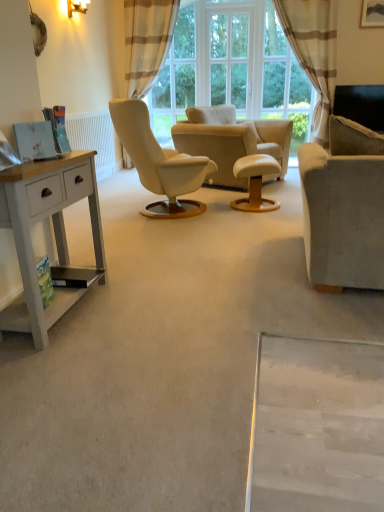
The image size is (384, 512). What do you see at coordinates (232, 142) in the screenshot? I see `beige fabric armchair at center` at bounding box center [232, 142].

Describe the element at coordinates (229, 58) in the screenshot. I see `clear glass window at center` at that location.

In order to face white leather ottoman at center, should I rotate leftwards or rightwards?

You should rotate right by 8.849 degrees.

The width and height of the screenshot is (384, 512). Identify the location of beige striped curtain at upper center. (314, 52).

Locate an element on the screen. light gray fabric couch at right is located at coordinates (344, 207).

What do you see at coordinates (344, 207) in the screenshot?
I see `light gray fabric couch at right` at bounding box center [344, 207].

Where is `white painted radiator at left`? The height and width of the screenshot is (512, 384). white painted radiator at left is located at coordinates (94, 139).

Looking at the image, does beige fabric armchair at center seem bigger or smaller compared to matte gold wall sconce at upper left?

Clearly, beige fabric armchair at center is larger in size than matte gold wall sconce at upper left.

From the image's perspective, which one is positioned higher, beige fabric armchair at center or matte gold wall sconce at upper left?

matte gold wall sconce at upper left.

Between beige fabric armchair at center and matte gold wall sconce at upper left, which one has larger width?

beige fabric armchair at center is wider.

From a real-world perspective, between beige fabric armchair at center and matte gold wall sconce at upper left, who is vertically higher?

matte gold wall sconce at upper left.

Is beige striped curtain at upper center to the left or to the right of beige fabric armchair at center in the image?

Based on their positions, beige striped curtain at upper center is located to the right of beige fabric armchair at center.

From the image's perspective, who appears lower, beige striped curtain at upper center or beige fabric armchair at center?

beige fabric armchair at center, from the image's perspective.

Which is correct: beige striped curtain at upper center is inside beige fabric armchair at center, or outside of it?

beige striped curtain at upper center is spatially situated outside beige fabric armchair at center.

Is beige striped curtain at upper center wider or thinner than beige fabric armchair at center?

Clearly, beige striped curtain at upper center has less width compared to beige fabric armchair at center.

Which of these two, matte gold wall sconce at upper left or white leather ottoman at center, is wider?

white leather ottoman at center is wider.

Is matte gold wall sconce at upper left next to white leather ottoman at center and touching it?

No, matte gold wall sconce at upper left is not next to white leather ottoman at center.

From a real-world perspective, which is physically below, matte gold wall sconce at upper left or white leather ottoman at center?

white leather ottoman at center.

Between matte gold wall sconce at upper left and white leather ottoman at center, which one appears on the left side from the viewer's perspective?

matte gold wall sconce at upper left is more to the left.

Who is taller, white painted wood desk at left or beige fabric armchair at center?

beige fabric armchair at center.

Does white painted wood desk at left have a greater width compared to beige fabric armchair at center?

No, white painted wood desk at left is not wider than beige fabric armchair at center.

From a real-world perspective, relative to beige fabric armchair at center, is white painted wood desk at left vertically above or below?

white painted wood desk at left is below beige fabric armchair at center.

From the image's perspective, is wooden picture frame at upper right positioned above or below matte gold wall sconce at upper left?

From the image's perspective, wooden picture frame at upper right appears above matte gold wall sconce at upper left.

Is matte gold wall sconce at upper left a part of wooden picture frame at upper right?

Definitely not — matte gold wall sconce at upper left is not inside wooden picture frame at upper right.

Can you confirm if wooden picture frame at upper right is shorter than matte gold wall sconce at upper left?

Incorrect, the height of wooden picture frame at upper right does not fall short of that of matte gold wall sconce at upper left.

Is wooden picture frame at upper right not near matte gold wall sconce at upper left?

Yes.

I want to click on picture frame above the white painted radiator at left (from the image's perspective), so click(x=372, y=13).

Is wooden picture frame at upper right turned away from white painted radiator at left?

wooden picture frame at upper right does not have its back to white painted radiator at left.

From the picture: Does wooden picture frame at upper right touch white painted radiator at left?

No.

From the image's perspective, is wooden picture frame at upper right located above white painted radiator at left?

Yes, from the image's perspective, wooden picture frame at upper right is over white painted radiator at left.

Between beige fabric armchair at center and beige striped curtain at upper center, which one is positioned in front?

beige fabric armchair at center is closer to the camera.

From the image's perspective, which one is positioned higher, beige fabric armchair at center or beige striped curtain at upper center?

From the image's view, beige striped curtain at upper center is above.

Does beige fabric armchair at center turn towards beige striped curtain at upper center?

No.

Would you say beige fabric armchair at center is a long distance from beige striped curtain at upper center?

beige fabric armchair at center is far away from beige striped curtain at upper center.

In order to click on lamp behind the beige fabric armchair at center in this screenshot , I will do `click(77, 7)`.

At what (x,y) coordinates should I click in order to perform the action: click on chair that is below the beige striped curtain at upper center (from the image's perspective). Please return your answer as a coordinate pair (x, y). Looking at the image, I should click on (232, 142).

Considering their positions, is matte gold wall sconce at upper left positioned closer to white painted wood desk at left than white painted radiator at left?

Based on the image, white painted radiator at left appears to be nearer to white painted wood desk at left.

Considering their positions, is clear glass window at center positioned closer to white leather ottoman at center than wooden picture frame at upper right?

wooden picture frame at upper right lies closer to white leather ottoman at center than the other object.

Based on their spatial positions, is white painted wood desk at left or clear glass window at center further from beige striped curtain at upper center?

Among the two, white painted wood desk at left is located further to beige striped curtain at upper center.

Estimate the real-world distances between objects in this image. Which object is further from white leather ottoman at center, beige striped curtain at upper center or wooden picture frame at upper right?

wooden picture frame at upper right lies further to white leather ottoman at center than the other object.

Which object lies nearer to the anchor point wooden picture frame at upper right, beige striped curtain at upper center or light gray fabric couch at right?

Among the two, beige striped curtain at upper center is located nearer to wooden picture frame at upper right.

From the image, which object appears to be farther from beige fabric armchair at center, white painted wood desk at left or clear glass window at center?

The object further to beige fabric armchair at center is white painted wood desk at left.

Considering their positions, is beige striped curtain at upper center positioned closer to matte gold wall sconce at upper left than wooden picture frame at upper right?

beige striped curtain at upper center is closer to matte gold wall sconce at upper left.

Which object lies further to the anchor point white painted wood desk at left, white leather ottoman at center or beige striped curtain at upper center?

beige striped curtain at upper center.

You are a GUI agent. You are given a task and a screenshot of the screen. Output one action in this format:
    pyautogui.click(x=<x>, y=<y>)
    Task: Click on the curtain between matte gold wall sconce at upper left and wooden picture frame at upper right
    The width and height of the screenshot is (384, 512).
    Given the screenshot: What is the action you would take?
    pyautogui.click(x=314, y=52)

Where is `window screen between wooden picture frame at upper right and white leather ottoman at center in the vertical direction`? The image size is (384, 512). window screen between wooden picture frame at upper right and white leather ottoman at center in the vertical direction is located at coordinates (229, 58).

In order to click on chair positioned between white painted wood desk at left and wooden picture frame at upper right from near to far in this screenshot , I will do `click(232, 142)`.

Find the location of a particular element. Image resolution: width=384 pixels, height=512 pixels. round table positioned between white painted wood desk at left and beige striped curtain at upper center from near to far is located at coordinates (255, 182).